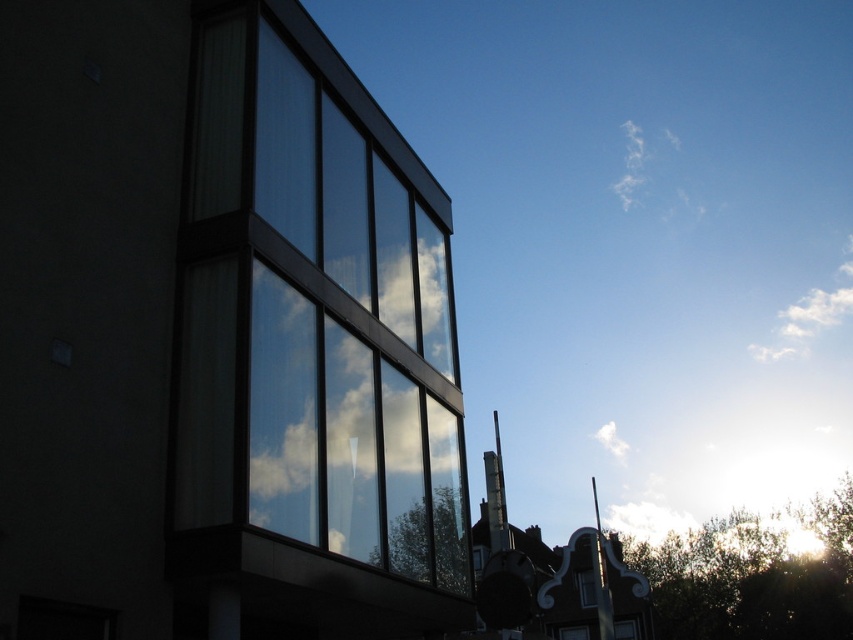
You are standing in front of the modern building with large rectangular windows. There is a point marked at coordinates (314, 312). What is located at that point?

The point at coordinates (314, 312) marks the location of the transparent glass window at center.

You are standing in front of the modern building with large rectangular windows and want to find the transparent glass window at center. Based on its coordinates, is it closer to the top or bottom of the building?

The transparent glass window at center is located at point (314, 312). Since the y coordinate is 0.369, which is closer to 0.5 than 0, it is closer to the bottom of the building.